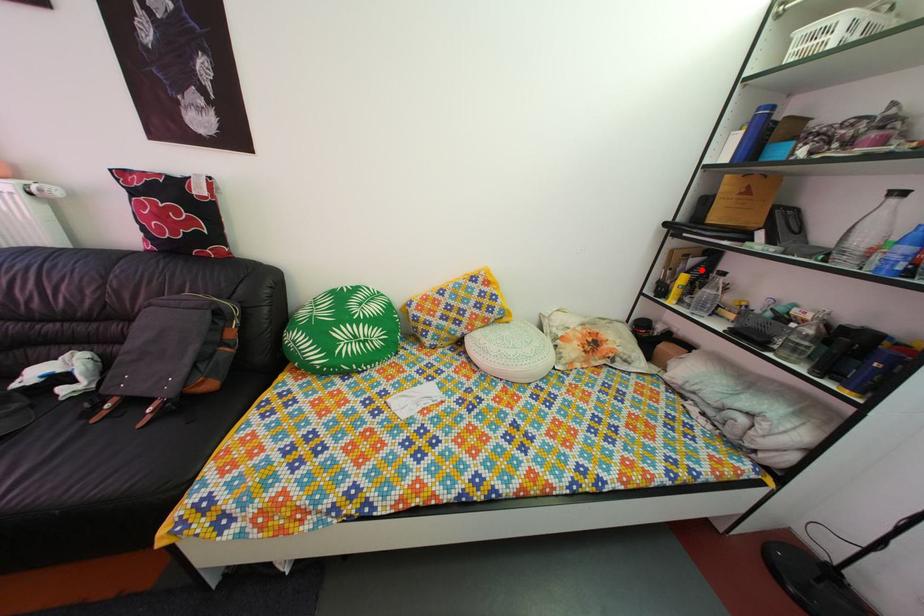
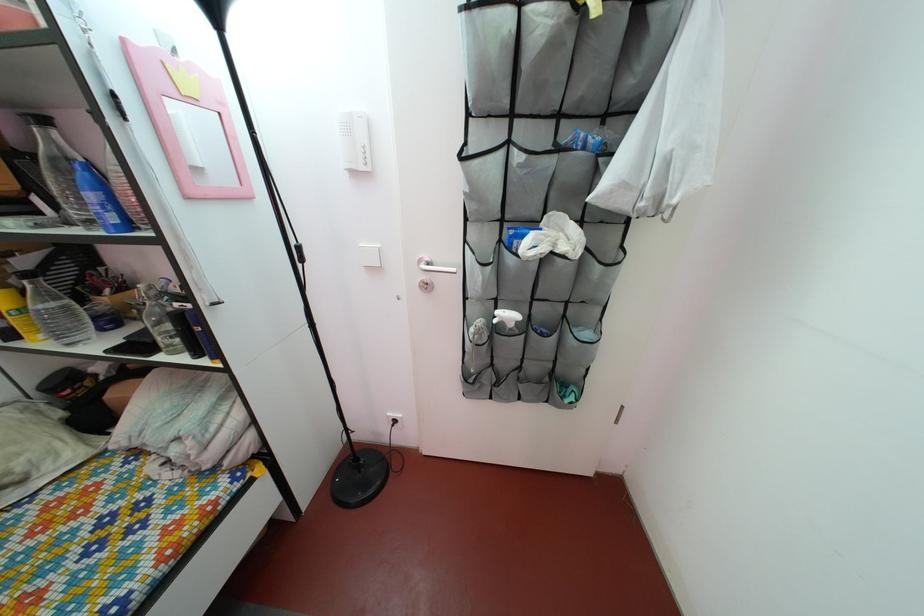
Question: I am providing you with two images of the same scene from different viewpoints. In image1, a red point is highlighted. Considering the same 3D point in image2, which of the following is correct?

Choices:
 (A) It is closer
 (B) It is farther

Answer: (B)